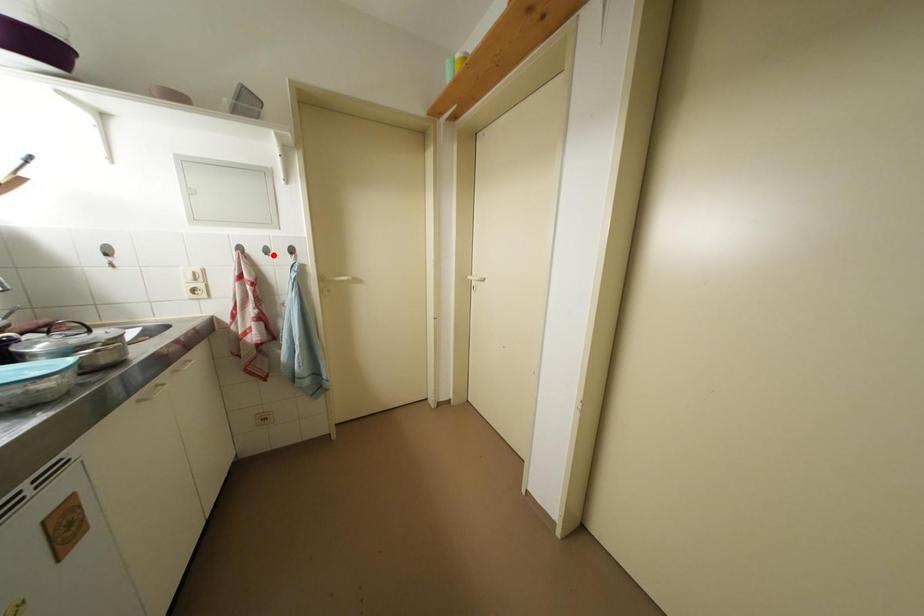
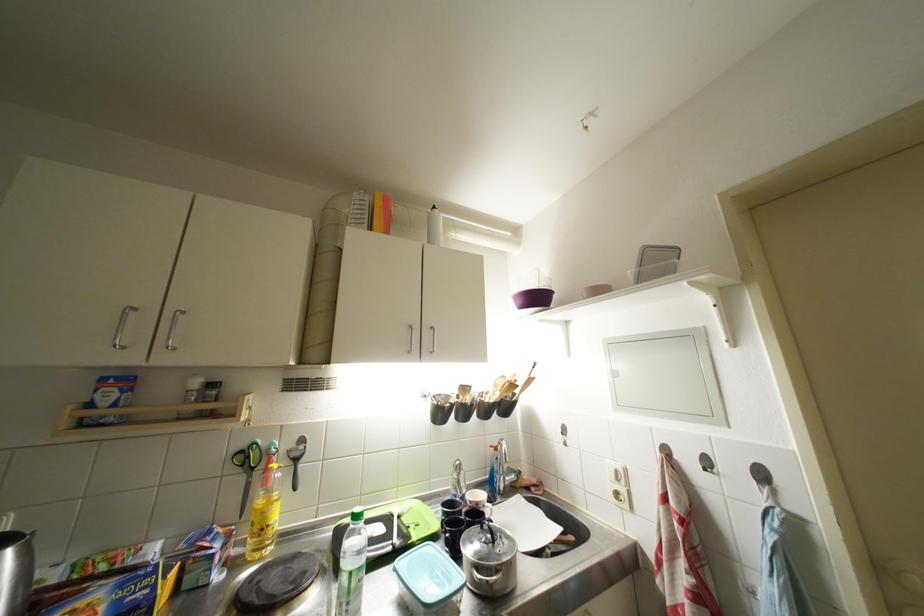
Question: I am providing you with two images of the same scene from different viewpoints. A red point is marked on the first image. Can you still see the location of the red point in image 2?

Choices:
 (A) Yes
 (B) No

Answer: (A)